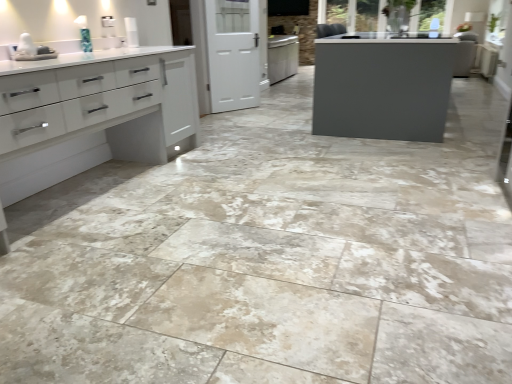
Question: From a real-world perspective, is white glossy sink at upper left positioned above or below white matte screen door at center?

Choices:
 (A) below
 (B) above

Answer: (B)

Question: From their relative heights in the image, would you say white glossy sink at upper left is taller or shorter than white matte screen door at center?

Choices:
 (A) tall
 (B) short

Answer: (B)

Question: Based on their relative distances, which object is nearer to the white matte screen door at center?

Choices:
 (A) white glossy cabinet at left
 (B) white glossy sink at upper left

Answer: (A)

Question: Based on their relative distances, which object is farther from the white glossy cabinet at left?

Choices:
 (A) white glossy sink at upper left
 (B) white matte screen door at center

Answer: (B)